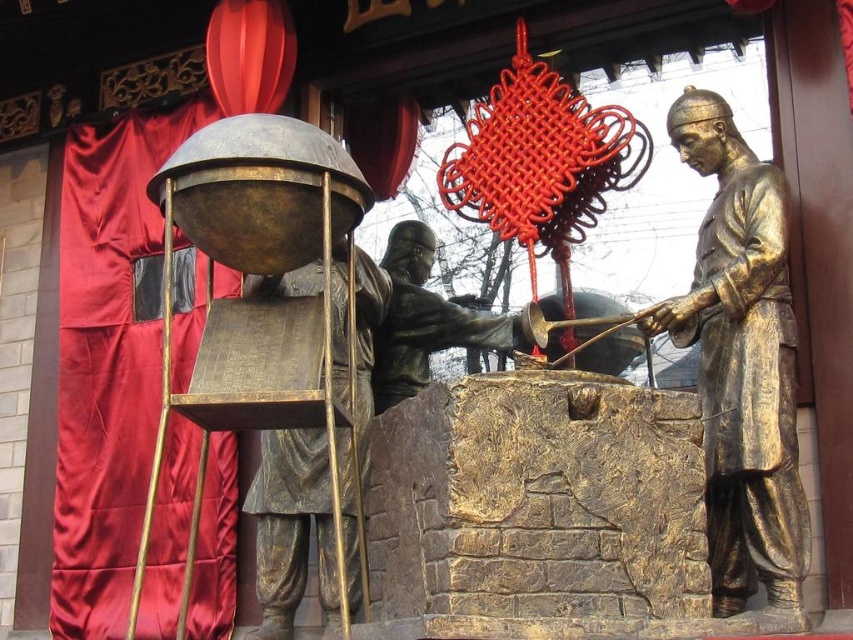
Question: Which object is farther from the camera taking this photo?

Choices:
 (A) bronze statue at center
 (B) bronze statue of person at center

Answer: (A)

Question: Which point is closer to the camera taking this photo?

Choices:
 (A) tap(393, 237)
 (B) tap(357, 368)

Answer: (B)

Question: Can you confirm if satin red curtain at left is bigger than bronze statue of person at center?

Choices:
 (A) yes
 (B) no

Answer: (A)

Question: Which point is farther to the camera?

Choices:
 (A) (135, 193)
 (B) (433, 340)
 (C) (701, 150)

Answer: (A)

Question: Can you confirm if bronze statue at right is thinner than bronze statue of person at center?

Choices:
 (A) no
 (B) yes

Answer: (A)

Question: Is satin red curtain at left above bronze statue at center?

Choices:
 (A) no
 (B) yes

Answer: (A)